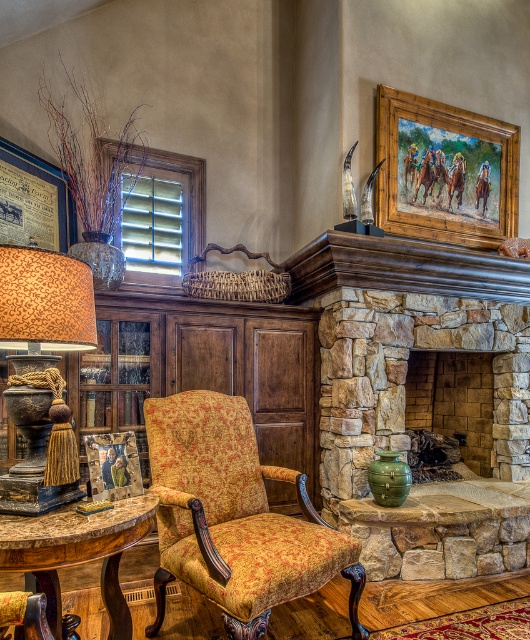
Question: Among these points, which one is farthest from the camera?

Choices:
 (A) (159, 486)
 (B) (20, 310)
 (C) (437, 410)

Answer: (C)

Question: Is patterned fabric armchair at center further to the viewer compared to brown stone fireplace at center?

Choices:
 (A) yes
 (B) no

Answer: (B)

Question: Observing the image, what is the correct spatial positioning of leopard print fabric lampshade at left in reference to rustic wood table at lower left?

Choices:
 (A) above
 (B) below

Answer: (A)

Question: Which point is closer to the camera?

Choices:
 (A) (466, 364)
 (B) (361, 628)

Answer: (B)

Question: Where is patterned fabric armchair at center located in relation to leopard print fabric lampshade at left in the image?

Choices:
 (A) right
 (B) left

Answer: (A)

Question: Which point is farther from the camera taking this photo?

Choices:
 (A) (30, 336)
 (B) (128, 627)
 (C) (304, 561)
 (D) (480, 365)

Answer: (D)